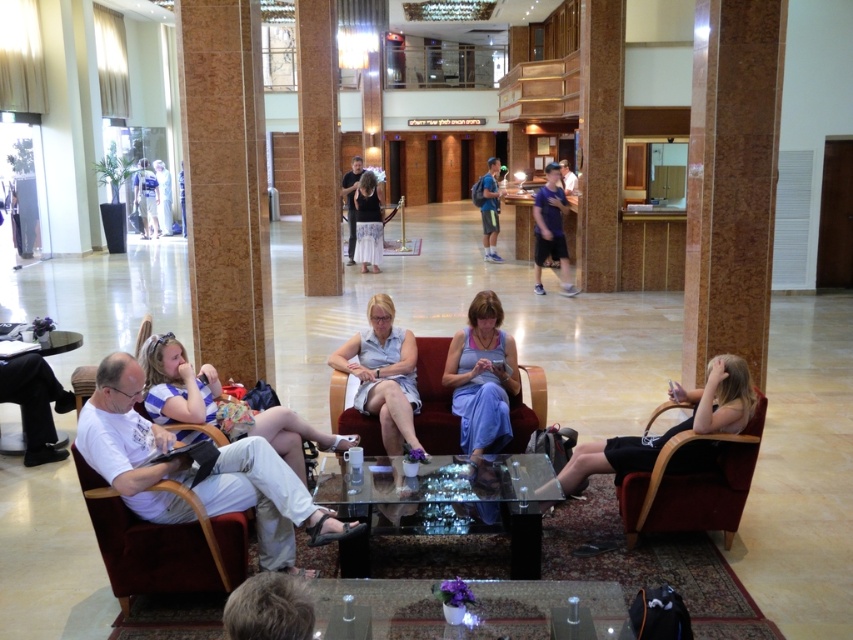
Question: Does black fabric dress at lower right have a lesser width compared to purple fabric dress at center?

Choices:
 (A) yes
 (B) no

Answer: (B)

Question: Is white cotton shirt at left positioned in front of dark gray pants at center?

Choices:
 (A) yes
 (B) no

Answer: (A)

Question: Among these points, which one is nearest to the camera?

Choices:
 (A) (523, 440)
 (B) (683, 470)
 (C) (374, 204)

Answer: (B)

Question: Which point is farther to the camera?

Choices:
 (A) (28, 392)
 (B) (349, 216)
 (C) (380, 465)

Answer: (B)

Question: Estimate the real-world distances between objects in this image. Which object is farther from the light blue fabric dress at center?

Choices:
 (A) white cotton dress at center
 (B) velvet-like burgundy armchair at lower right

Answer: (A)

Question: Does transparent glass table at center appear over matte white armchair at left?

Choices:
 (A) yes
 (B) no

Answer: (B)